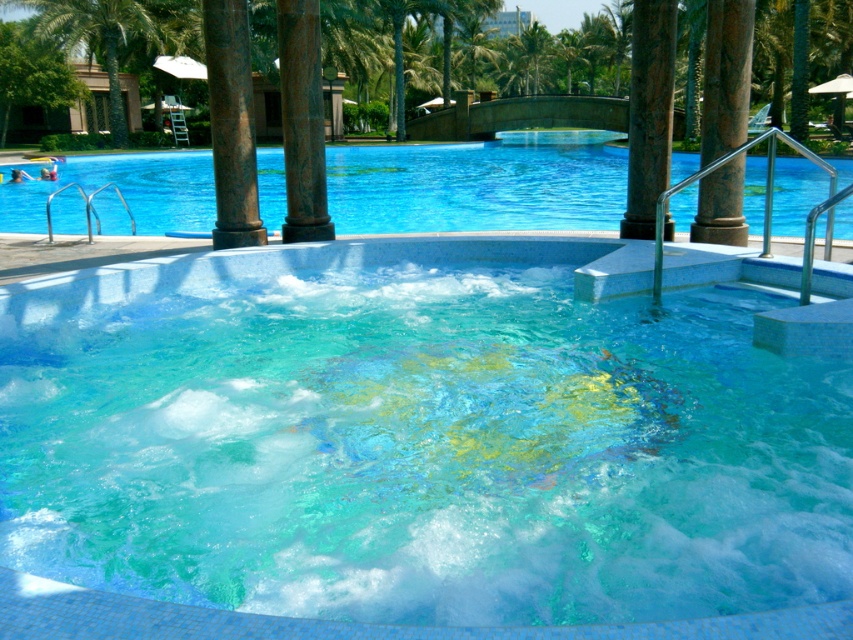
Which is in front, point (404, 179) or point (668, 125)?

Point (668, 125)

Is point (579, 189) positioned after point (659, 115)?

Yes, it is behind point (659, 115).

Identify the location of clear blue water at upper center. Image resolution: width=853 pixels, height=640 pixels. (474, 186).

From the picture: Who is more forward, [227,26] or [62,38]?

Point [227,26] is more forward.

Does rusty metal pillar at center appear under green leafy palm tree at upper left?

Yes.

Who is more distant from viewer, (207, 3) or (26, 1)?

Point (26, 1)

This screenshot has width=853, height=640. What are the coordinates of `rusty metal pillar at center` in the screenshot? It's located at pyautogui.click(x=231, y=124).

You are a GUI agent. You are given a task and a screenshot of the screen. Output one action in this format:
    pyautogui.click(x=<x>, y=<y>)
    Task: Click on the clear blue water at upper center
    
    Given the screenshot: What is the action you would take?
    pyautogui.click(x=474, y=186)

Is clear blue water at upper center thinner than green leafy palm tree at upper left?

Incorrect, clear blue water at upper center's width is not less than green leafy palm tree at upper left's.

Who is more distant from viewer, (824,189) or (138,33)?

The point (138,33) is more distant.

Locate an element on the screen. The width and height of the screenshot is (853, 640). clear blue water at upper center is located at coordinates (474, 186).